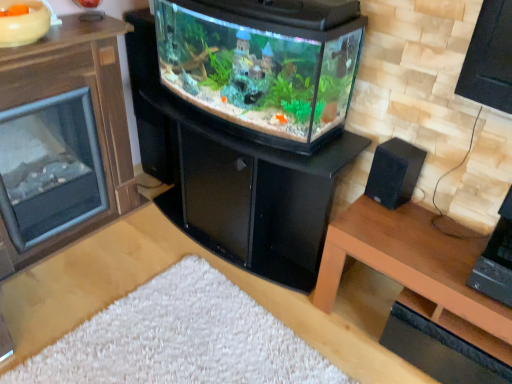
Locate an element on the screen. This screenshot has width=512, height=384. vacant area that is in front of black glossy fireplace at center is located at coordinates (223, 308).